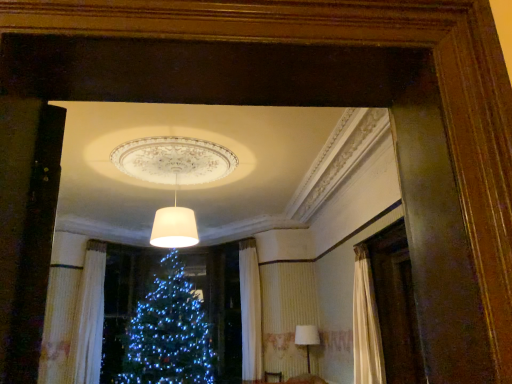
You are a GUI agent. You are given a task and a screenshot of the screen. Output one action in this format:
    pyautogui.click(x=<x>, y=<y>)
    Task: Click on the white textured curtain at lower left
    This screenshot has height=384, width=512.
    Given the screenshot: What is the action you would take?
    pos(90,316)

This screenshot has width=512, height=384. What do you see at coordinates (90, 316) in the screenshot? I see `white textured curtain at lower left` at bounding box center [90, 316].

What is the approximate width of white fabric lampshade at lower right, the 1th lamp in the bottom-to-top sequence?

17.32 inches.

The width and height of the screenshot is (512, 384). Identify the location of white matte lampshade at center, acting as the first lamp starting from the left. (174, 226).

Between white textured curtain at lower left and white fabric lampshade at lower right, placed as the first lamp when sorted from right to left, which one has less height?

white fabric lampshade at lower right, placed as the first lamp when sorted from right to left, is shorter.

Is white textured curtain at lower left not inside white fabric lampshade at lower right, the 1th lamp in the bottom-to-top sequence?

white textured curtain at lower left is positioned outside white fabric lampshade at lower right, the 1th lamp in the bottom-to-top sequence.

Considering the positions of objects white fabric lampshade at lower right, the 1th lamp in the bottom-to-top sequence, and white matte lampshade at center, acting as the first lamp starting from the left, in the image provided, who is in front, white fabric lampshade at lower right, the 1th lamp in the bottom-to-top sequence, or white matte lampshade at center, acting as the first lamp starting from the left,?

white matte lampshade at center, acting as the first lamp starting from the left.

Does white fabric lampshade at lower right, the second lamp from the top, turn towards white matte lampshade at center, the first lamp positioned from the top?

Yes, white fabric lampshade at lower right, the second lamp from the top, is aimed at white matte lampshade at center, the first lamp positioned from the top.

From the picture: Visually, is white fabric lampshade at lower right, arranged as the 2th lamp when viewed from the left, positioned to the left or to the right of white matte lampshade at center, acting as the first lamp starting from the left?

white fabric lampshade at lower right, arranged as the 2th lamp when viewed from the left, is to the right of white matte lampshade at center, acting as the first lamp starting from the left.

Is white textured curtain at lower left aimed at white matte lampshade at center, which is the first lamp in front-to-back order?

Yes, white textured curtain at lower left is facing white matte lampshade at center, which is the first lamp in front-to-back order.

Find the location of a particular element. The width and height of the screenshot is (512, 384). curtain lying behind the white matte lampshade at center, the first lamp positioned from the top is located at coordinates (90, 316).

Is white textured curtain at lower left behind white matte lampshade at center, the first lamp positioned from the top?

That is True.

Is white textured curtain at lower left taller or shorter than white matte lampshade at center, arranged as the second lamp when ordered from the bottom?

white textured curtain at lower left is taller than white matte lampshade at center, arranged as the second lamp when ordered from the bottom.

From a real-world perspective, which object stands above the other?

In real-world perspective, white textured curtain at lower left is above.

How distant is white fabric lampshade at lower right, the 1th lamp in the bottom-to-top sequence, from white textured curtain at lower left?

white fabric lampshade at lower right, the 1th lamp in the bottom-to-top sequence, and white textured curtain at lower left are 3.44 meters apart from each other.

From the image's perspective, is white fabric lampshade at lower right, the second lamp from the top, below white textured curtain at lower left?

Yes, from the image's perspective, white fabric lampshade at lower right, the second lamp from the top, is beneath white textured curtain at lower left.

How different are the orientations of white fabric lampshade at lower right, arranged as the 2th lamp when viewed from the left, and white textured curtain at lower left in degrees?

The angle between the facing direction of white fabric lampshade at lower right, arranged as the 2th lamp when viewed from the left, and the facing direction of white textured curtain at lower left is 86.8 degrees.

Is white matte lampshade at center, the first lamp positioned from the top, turned away from white fabric lampshade at lower right, placed as the first lamp when sorted from right to left?

No, white fabric lampshade at lower right, placed as the first lamp when sorted from right to left, is not at the back of white matte lampshade at center, the first lamp positioned from the top.

Are white matte lampshade at center, the first lamp positioned from the top, and white fabric lampshade at lower right, the 1th lamp in the bottom-to-top sequence, located far from each other?

Yes, white matte lampshade at center, the first lamp positioned from the top, is far from white fabric lampshade at lower right, the 1th lamp in the bottom-to-top sequence.

From a real-world perspective, is white matte lampshade at center, the 2th lamp positioned from the right, above or below white fabric lampshade at lower right, the 1th lamp in the bottom-to-top sequence?

Clearly, from a real-world perspective, white matte lampshade at center, the 2th lamp positioned from the right, is above white fabric lampshade at lower right, the 1th lamp in the bottom-to-top sequence.

Is white matte lampshade at center, the first lamp positioned from the top, to the left of white fabric lampshade at lower right, the second lamp from the top, from the viewer's perspective?

Indeed, white matte lampshade at center, the first lamp positioned from the top, is positioned on the left side of white fabric lampshade at lower right, the second lamp from the top.

Is white matte lampshade at center, the 2th lamp positioned from the right, oriented towards white textured curtain at lower left?

No, white matte lampshade at center, the 2th lamp positioned from the right, is not aimed at white textured curtain at lower left.

From the white textured curtain at lower left, count 1st lamp to the right and point to it. Please provide its 2D coordinates.

[(174, 226)]

Considering the positions of points (164, 231) and (100, 353), is point (164, 231) farther from camera compared to point (100, 353)?

No, it is not.

In terms of width, does white matte lampshade at center, which appears as the second lamp when viewed from the back, look wider or thinner when compared to white textured curtain at lower left?

white matte lampshade at center, which appears as the second lamp when viewed from the back, is wider than white textured curtain at lower left.

I want to click on lamp below the white textured curtain at lower left (from a real-world perspective), so click(307, 340).

Find the location of a particular element. lamp that appears on the left of white fabric lampshade at lower right, placed as the first lamp when sorted from right to left is located at coordinates (174, 226).

From the image, which object appears to be nearer to white fabric lampshade at lower right, the second lamp from the top, white textured curtain at lower left or white matte lampshade at center, acting as the first lamp starting from the left?

white matte lampshade at center, acting as the first lamp starting from the left, is closer to white fabric lampshade at lower right, the second lamp from the top.

Which object lies nearer to the anchor point white matte lampshade at center, which is the first lamp in front-to-back order, white fabric lampshade at lower right, the 1th lamp in the bottom-to-top sequence, or white textured curtain at lower left?

Based on the image, white fabric lampshade at lower right, the 1th lamp in the bottom-to-top sequence, appears to be nearer to white matte lampshade at center, which is the first lamp in front-to-back order.

When comparing their distances from white textured curtain at lower left, does white fabric lampshade at lower right, the second lamp from the top, or white matte lampshade at center, the first lamp positioned from the top, seem closer?

Among the two, white matte lampshade at center, the first lamp positioned from the top, is located nearer to white textured curtain at lower left.

Looking at the image, which one is located closer to white textured curtain at lower left, white matte lampshade at center, acting as the first lamp starting from the left, or white fabric lampshade at lower right, arranged as the 2th lamp when viewed from the left?

white matte lampshade at center, acting as the first lamp starting from the left, is positioned closer to the anchor white textured curtain at lower left.

Looking at the image, which one is located further to white matte lampshade at center, arranged as the second lamp when ordered from the bottom, white textured curtain at lower left or white fabric lampshade at lower right, the second lamp positioned from the front?

white textured curtain at lower left.

Estimate the real-world distances between objects in this image. Which object is closer to white fabric lampshade at lower right, placed as the first lamp when sorted from right to left, white matte lampshade at center, arranged as the second lamp when ordered from the bottom, or white textured curtain at lower left?

Among the two, white matte lampshade at center, arranged as the second lamp when ordered from the bottom, is located nearer to white fabric lampshade at lower right, placed as the first lamp when sorted from right to left.

Locate an element on the screen. Image resolution: width=512 pixels, height=384 pixels. lamp located between white textured curtain at lower left and white fabric lampshade at lower right, arranged as the 2th lamp when viewed from the left, in the left-right direction is located at coordinates (174, 226).